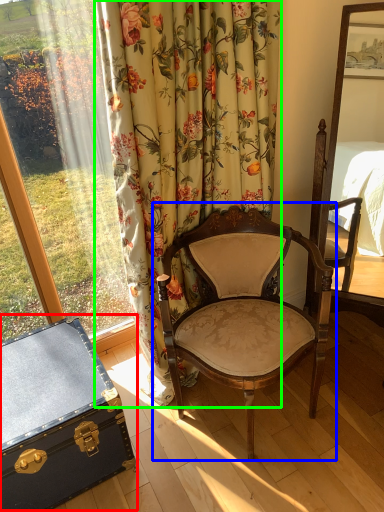
Question: Considering the real-world distances, which object is closest to chest (highlighted by a red box)? chair (highlighted by a blue box) or curtain (highlighted by a green box).

Choices:
 (A) chair
 (B) curtain

Answer: (A)